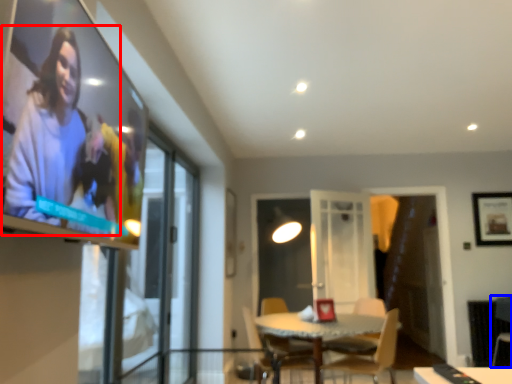
Question: Which point is closer to the camera, person (highlighted by a red box) or armchair (highlighted by a blue box)?

Choices:
 (A) person
 (B) armchair

Answer: (A)